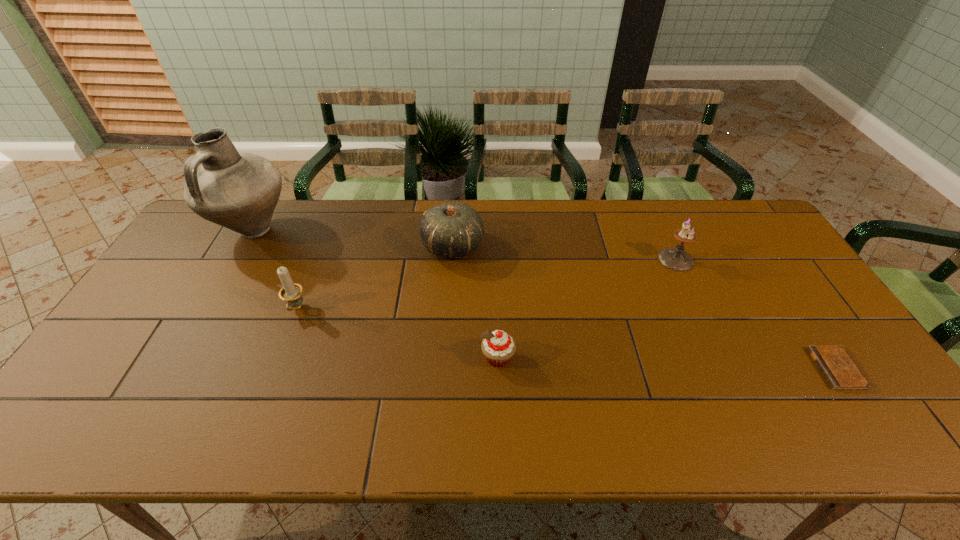
You are a GUI agent. You are given a task and a screenshot of the screen. Output one action in this format:
    pyautogui.click(x=<x>, y=<y>)
    Task: Click on the free region located on the handle side of the tallest object
    Image resolution: width=960 pixels, height=540 pixels.
    Given the screenshot: What is the action you would take?
    pyautogui.click(x=198, y=328)

The height and width of the screenshot is (540, 960). Find the location of `free region located on the right of the farther candle_holder`. free region located on the right of the farther candle_holder is located at coordinates (747, 259).

The image size is (960, 540). In order to click on vacant region located on the front of the gourd in this screenshot , I will do `click(448, 316)`.

I want to click on vacant position located on the handle side of the nearer candle_holder, so click(280, 350).

I want to click on vacant space located on the front of the cupcake, so click(x=499, y=401).

The image size is (960, 540). I want to click on vacant space located 0.270m on the spine side of the rightmost object, so click(710, 368).

This screenshot has height=540, width=960. What are the coordinates of `free space located 0.340m on the spine side of the rightmost object` in the screenshot? It's located at (683, 368).

Locate an element on the screen. vacant space located 0.390m on the spine side of the rightmost object is located at coordinates (662, 368).

What are the coordinates of `pitcher that is at the far edge` in the screenshot? It's located at (237, 190).

The height and width of the screenshot is (540, 960). What are the coordinates of `gourd located in the far edge section of the desktop` in the screenshot? It's located at (452, 229).